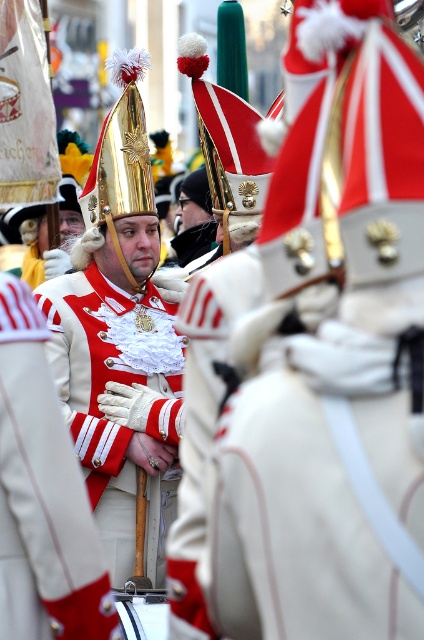
Question: Does white matte uniform at center appear over white satin uniform at center?

Choices:
 (A) no
 (B) yes

Answer: (B)

Question: From the image, what is the correct spatial relationship of white matte uniform at center in relation to white satin uniform at center?

Choices:
 (A) left
 (B) right

Answer: (A)

Question: Is white matte uniform at center smaller than white satin uniform at center?

Choices:
 (A) yes
 (B) no

Answer: (A)

Question: Which of the following is the farthest from the observer?

Choices:
 (A) white matte uniform at center
 (B) white satin uniform at center

Answer: (B)